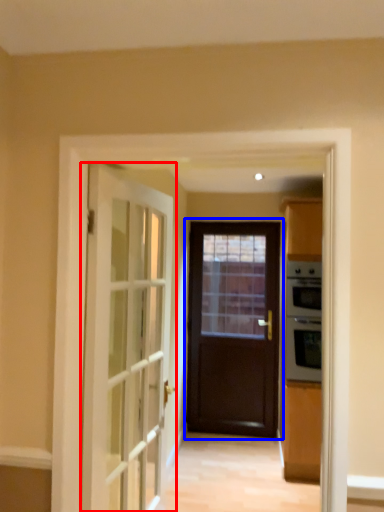
Question: Which of the following is the closest to the observer, door (highlighted by a red box) or door (highlighted by a blue box)?

Choices:
 (A) door
 (B) door

Answer: (A)